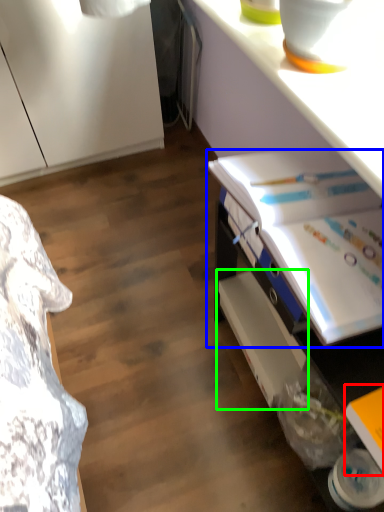
Question: Estimate the real-world distances between objects in this image. Which object is farther from book (highlighted by a red box), book (highlighted by a blue box) or shelf (highlighted by a green box)?

Choices:
 (A) book
 (B) shelf

Answer: (B)